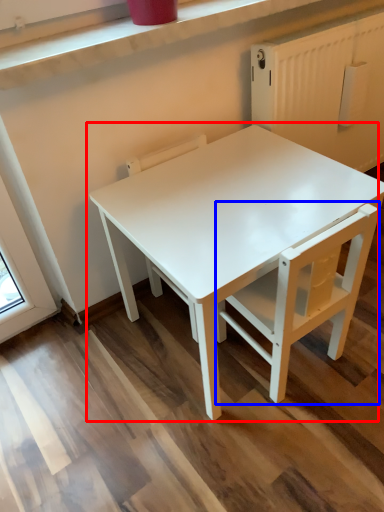
Question: Which point is closer to the camera, table (highlighted by a red box) or chair (highlighted by a blue box)?

Choices:
 (A) table
 (B) chair

Answer: (A)